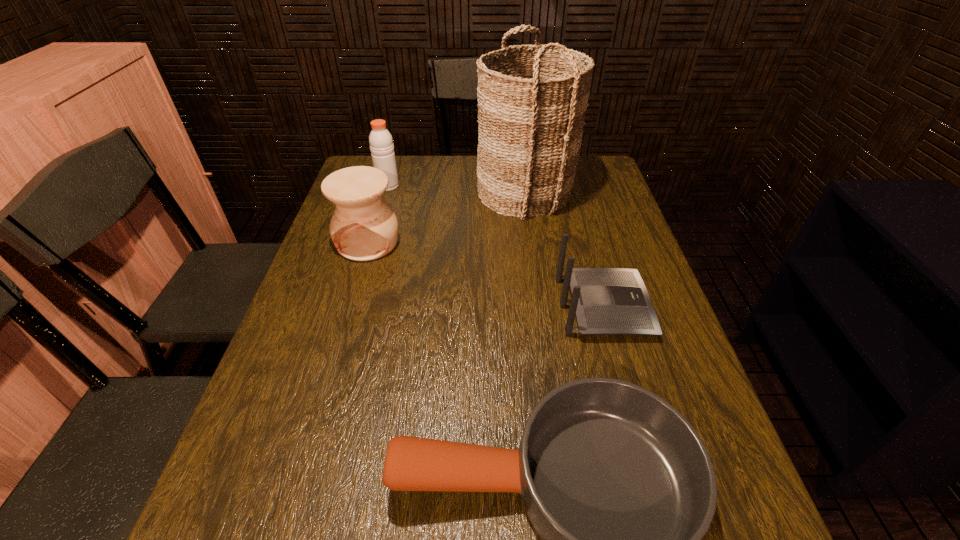
Locate an element on the screen. vacant area between the third nearest object and the tallest object is located at coordinates (446, 217).

Find the location of `unoccupied position between the shaker and the second nearest object`. unoccupied position between the shaker and the second nearest object is located at coordinates (495, 246).

Identify the location of empty location between the shaker and the tallest object. This screenshot has height=540, width=960. (457, 189).

Point out which object is positioned as the second nearest to the nearest object. Please provide its 2D coordinates. Your answer should be formatted as a tuple, i.e. [(x, y)], where the tuple contains the x and y coordinates of a point satisfying the conditions above.

[(363, 227)]

Locate an element on the screen. The image size is (960, 540). the second closest object to the shortest object is located at coordinates (363, 227).

Where is `free space that satisfies the following two spatial constraints: 1. on the front side of the shaker; 2. on the right side of the basket`? free space that satisfies the following two spatial constraints: 1. on the front side of the shaker; 2. on the right side of the basket is located at coordinates (386, 192).

Locate an element on the screen. The height and width of the screenshot is (540, 960). vacant position in the image that satisfies the following two spatial constraints: 1. on the front-facing side of the second shortest object; 2. at the open side of the third nearest object is located at coordinates (586, 242).

Find the location of a particular element. Image resolution: width=960 pixels, height=540 pixels. free space that satisfies the following two spatial constraints: 1. at the open side of the third nearest object; 2. on the front-facing side of the second shortest object is located at coordinates (348, 307).